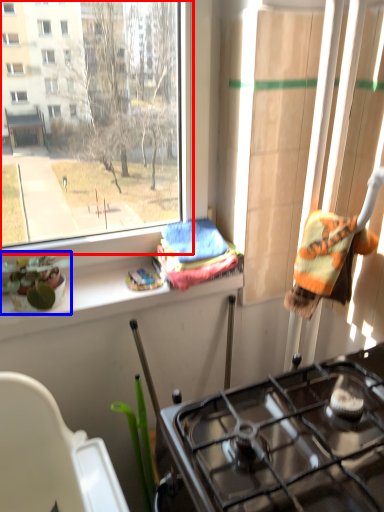
Question: Which of the following is the farthest to the observer, window (highlighted by a red box) or houseplant (highlighted by a blue box)?

Choices:
 (A) window
 (B) houseplant

Answer: (B)